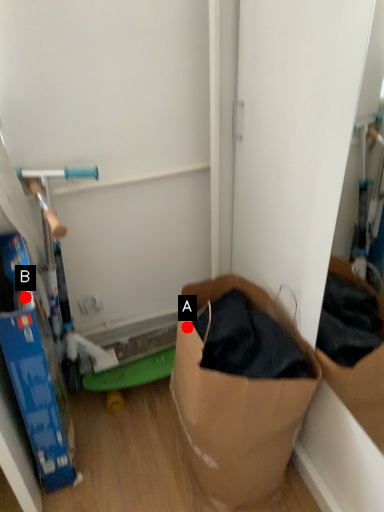
Question: Two points are circled on the image, labeled by A and B beside each circle. Among these points, which one is farthest from the camera?

Choices:
 (A) A is further
 (B) B is further

Answer: (A)